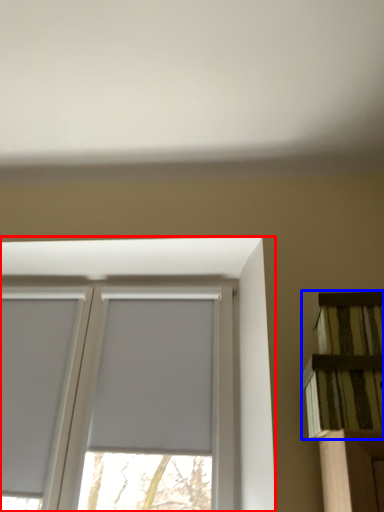
Question: Which object appears closest to the camera in this image, window (highlighted by a red box) or shelf (highlighted by a blue box)?

Choices:
 (A) window
 (B) shelf

Answer: (B)